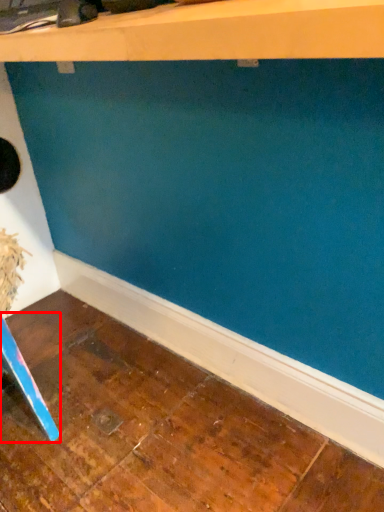
Question: From the image's perspective, where is furniture (annotated by the red box) located in relation to shelf in the image?

Choices:
 (A) above
 (B) below

Answer: (B)